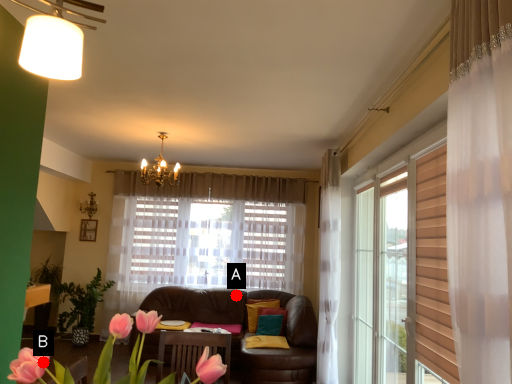
Question: Two points are circled on the image, labeled by A and B beside each circle. Which point is farther to the camera?

Choices:
 (A) A is further
 (B) B is further

Answer: (A)